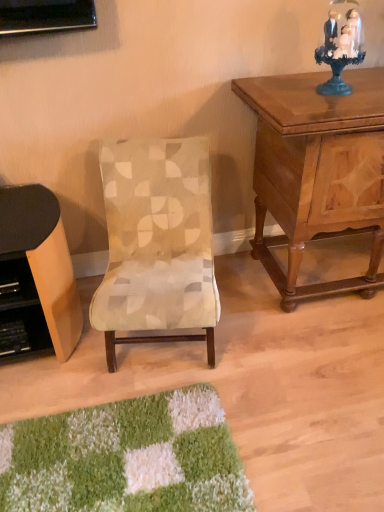
Image resolution: width=384 pixels, height=512 pixels. What are the coordinates of `free space in front of light brown wood desk at left` in the screenshot? It's located at (x=56, y=403).